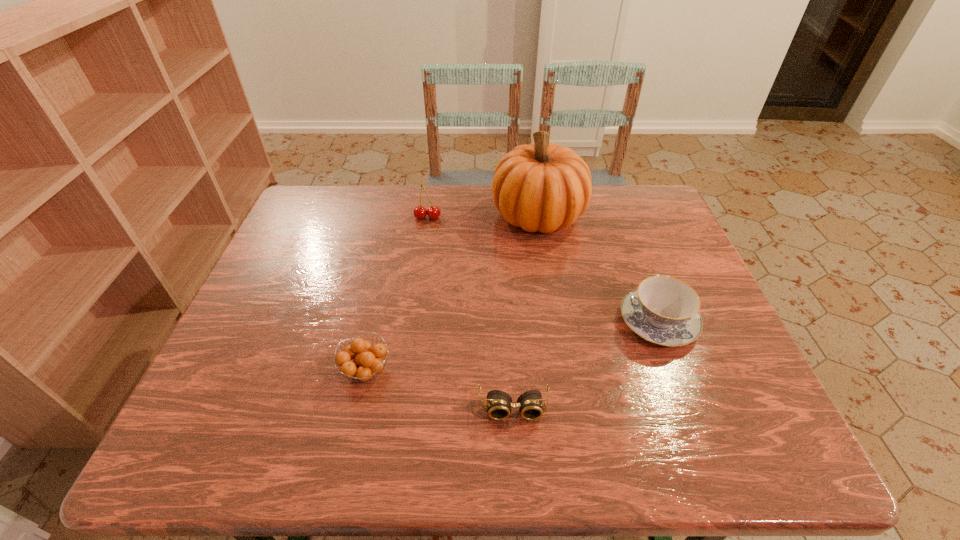
The width and height of the screenshot is (960, 540). In order to click on pumpkin in this screenshot , I will do tap(544, 187).

Locate an element on the screen. the fourth shortest object is located at coordinates (420, 212).

I want to click on chinaware, so click(x=663, y=310).

The width and height of the screenshot is (960, 540). What are the coordinates of `orange fruit` in the screenshot? It's located at (367, 361).

What are the coordinates of `goggles` in the screenshot? It's located at [530, 403].

Identify the location of vacant area located on the front of the tallest object. (558, 335).

This screenshot has height=540, width=960. I want to click on vacant space located with the stems of the cherry pointing upwards, so click(419, 284).

The image size is (960, 540). Find the location of `free region located 0.090m with the handle on the side of the rightmost object`. free region located 0.090m with the handle on the side of the rightmost object is located at coordinates (637, 268).

Where is `free space located 0.280m with the handle on the side of the rightmost object`? free space located 0.280m with the handle on the side of the rightmost object is located at coordinates (621, 225).

Find the location of a particular element. This screenshot has height=540, width=960. vacant space located with the handle on the side of the rightmost object is located at coordinates (630, 247).